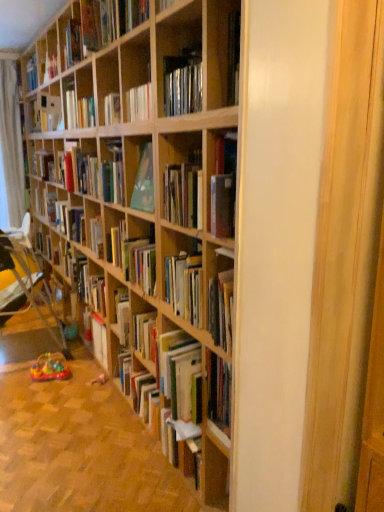
At what (x,y) coordinates should I click in order to perform the action: click on wooden bookcase at center. Please return your answer as a coordinate pair (x, y). This screenshot has height=512, width=384. Looking at the image, I should click on (151, 200).

This screenshot has width=384, height=512. In order to click on matte red book at center, which is counted as the 3th book, starting from the bottom in this screenshot , I will do `click(80, 172)`.

How much space does matte red book at center, which is counted as the 3th book, starting from the bottom, occupy horizontally?

matte red book at center, which is counted as the 3th book, starting from the bottom, is 6.97 inches in width.

Find the location of a particular element. Image resolution: width=384 pixels, height=512 pixels. wooden folding chair at lower left is located at coordinates (29, 275).

I want to click on hardcover book at center, which appears as the second book when ordered from the bottom, so click(134, 257).

Locate an element on the screen. Image resolution: width=384 pixels, height=512 pixels. hardcover book at upper left, marked as the first book in a top-to-bottom arrangement is located at coordinates (97, 24).

Does hardcover book at upper left, marked as the first book in a top-to-bottom arrangement, turn towards hardcover book at center, the third book when ordered from top to bottom?

No, hardcover book at upper left, marked as the first book in a top-to-bottom arrangement, is not oriented towards hardcover book at center, the third book when ordered from top to bottom.

Does hardcover book at upper left, marked as the first book in a top-to-bottom arrangement, have a smaller size compared to hardcover book at center, the third book when ordered from top to bottom?

Indeed, hardcover book at upper left, marked as the first book in a top-to-bottom arrangement, has a smaller size compared to hardcover book at center, the third book when ordered from top to bottom.

Based on the photo, considering the positions of objects hardcover book at upper left, marked as the first book in a top-to-bottom arrangement, and hardcover book at center, the third book when ordered from top to bottom, in the image provided, who is in front, hardcover book at upper left, marked as the first book in a top-to-bottom arrangement, or hardcover book at center, the third book when ordered from top to bottom,?

hardcover book at upper left, marked as the first book in a top-to-bottom arrangement.

Is hardcover book at upper left, the fourth book in the bottom-to-top sequence, completely or partially outside of hardcover book at center, the third book when ordered from top to bottom?

Yes.

From a real-world perspective, is white sheer curtain at left above or below wooden bookcase at center?

white sheer curtain at left is situated higher than wooden bookcase at center in the real world.

Considering the sizes of white sheer curtain at left and wooden bookcase at center in the image, is white sheer curtain at left taller or shorter than wooden bookcase at center?

Considering their sizes, white sheer curtain at left has more height than wooden bookcase at center.

Is white sheer curtain at left touching wooden bookcase at center?

No.

Considering the relative sizes of matte red book at center, which is counted as the 3th book, starting from the bottom, and wooden folding chair at lower left in the image provided, is matte red book at center, which is counted as the 3th book, starting from the bottom, wider than wooden folding chair at lower left?

No, matte red book at center, which is counted as the 3th book, starting from the bottom, is not wider than wooden folding chair at lower left.

Is matte red book at center, the second book from the top, taller or shorter than wooden folding chair at lower left?

Clearly, matte red book at center, the second book from the top, is shorter compared to wooden folding chair at lower left.

From the image's perspective, is matte red book at center, the second book from the top, beneath wooden folding chair at lower left?

No, from the image's perspective, matte red book at center, the second book from the top, is not beneath wooden folding chair at lower left.

This screenshot has height=512, width=384. In order to click on chair on the left of matte red book at center, the second book from the top in this screenshot , I will do `click(29, 275)`.

Does matte red book at center, which is counted as the 3th book, starting from the bottom, appear on the right side of plastic multicolored toy at lower left?

Yes, matte red book at center, which is counted as the 3th book, starting from the bottom, is to the right of plastic multicolored toy at lower left.

What's the angular difference between matte red book at center, the second book from the top, and plastic multicolored toy at lower left's facing directions?

The facing directions of matte red book at center, the second book from the top, and plastic multicolored toy at lower left are 0.0495 degrees apart.

From the image's perspective, is matte red book at center, the second book from the top, positioned above or below plastic multicolored toy at lower left?

Based on their image positions, matte red book at center, the second book from the top, is located above plastic multicolored toy at lower left.

From a real-world perspective, who is located lower, matte red book at center, which is counted as the 3th book, starting from the bottom, or plastic multicolored toy at lower left?

In real-world perspective, plastic multicolored toy at lower left is lower.

From the image's perspective, who appears lower, hardcover book at center, the third book when ordered from top to bottom, or hardcover book at upper left, marked as the first book in a top-to-bottom arrangement?

hardcover book at center, the third book when ordered from top to bottom, from the image's perspective.

Between hardcover book at center, the third book when ordered from top to bottom, and hardcover book at upper left, the fourth book in the bottom-to-top sequence, which one has smaller width?

hardcover book at center, the third book when ordered from top to bottom, is thinner.

What's the angular difference between hardcover book at center, the third book when ordered from top to bottom, and hardcover book at upper left, marked as the first book in a top-to-bottom arrangement,'s facing directions?

The angular difference between hardcover book at center, the third book when ordered from top to bottom, and hardcover book at upper left, marked as the first book in a top-to-bottom arrangement, is 0.00172 degrees.

From a real-world perspective, which object rests below the other?

hardcover book at center, which appears as the second book when ordered from the bottom, from a real-world perspective.

Which is closer, [60,102] or [126,280]?

Point [60,102] is positioned farther from the camera compared to point [126,280].

Between wooden bookcase at center and hardcover book at center, which appears as the second book when ordered from the bottom, which one is positioned in front?

wooden bookcase at center is in front.

Between wooden bookcase at center and hardcover book at center, the third book when ordered from top to bottom, which one has larger width?

hardcover book at center, the third book when ordered from top to bottom.

Is there a large distance between wooden bookcase at center and hardcover book at center, the third book when ordered from top to bottom?

No, wooden bookcase at center is in close proximity to hardcover book at center, the third book when ordered from top to bottom.

Between wooden folding chair at lower left and hardcover book at upper left, the fourth book in the bottom-to-top sequence, which one has larger width?

wooden folding chair at lower left.

Is wooden folding chair at lower left not near hardcover book at upper left, marked as the first book in a top-to-bottom arrangement?

Yes, wooden folding chair at lower left is far from hardcover book at upper left, marked as the first book in a top-to-bottom arrangement.

Consider the image. Considering the positions of objects wooden folding chair at lower left and hardcover book at upper left, marked as the first book in a top-to-bottom arrangement, in the image provided, who is more to the right, wooden folding chair at lower left or hardcover book at upper left, marked as the first book in a top-to-bottom arrangement,?

From the viewer's perspective, hardcover book at upper left, marked as the first book in a top-to-bottom arrangement, appears more on the right side.

From the image's perspective, is wooden folding chair at lower left beneath hardcover book at upper left, marked as the first book in a top-to-bottom arrangement?

Indeed, from the image's perspective, wooden folding chair at lower left is shown beneath hardcover book at upper left, marked as the first book in a top-to-bottom arrangement.

The height and width of the screenshot is (512, 384). I want to click on the 2nd book in front of the hardcover book at center, which appears as the second book when ordered from the bottom, starting your count from the anchor, so click(x=97, y=24).

In the image, there is a wooden bookcase at center. Identify the location of curtain above it (from the image's perspective). (11, 142).

Looking at the image, which one is located closer to wooden bookcase at center, hardcover book at center, the third book when ordered from top to bottom, or hardcover book at upper left, marked as the first book in a top-to-bottom arrangement?

hardcover book at center, the third book when ordered from top to bottom, lies closer to wooden bookcase at center than the other object.

Looking at the image, which one is located closer to plastic multicolored toy at lower left, white sheer curtain at left or wooden folding chair at lower left?

wooden folding chair at lower left.

Based on their spatial positions, is plastic multicolored toy at lower left or wooden folding chair at lower left further from white sheer curtain at left?

The object further to white sheer curtain at left is plastic multicolored toy at lower left.

From the image, which object appears to be farther from matte red book at center, the second book from the top, wooden bookcase at center or white sheer curtain at left?

white sheer curtain at left.

Estimate the real-world distances between objects in this image. Which object is further from matte red book at center, the second book from the top, hardcover book at center, the third book when ordered from top to bottom, or wooden bookcase at center?

wooden bookcase at center is further to matte red book at center, the second book from the top.

Based on their spatial positions, is wooden bookcase at center or hardcover book at center, the third book when ordered from top to bottom, closer to hardcover book at upper left, the fourth book in the bottom-to-top sequence?

wooden bookcase at center.

Which object lies further to the anchor point hardcover book at center, the third book when ordered from top to bottom, hardcover book at center, the fourth book in the top-to-bottom sequence, or hardcover book at upper left, marked as the first book in a top-to-bottom arrangement?

hardcover book at upper left, marked as the first book in a top-to-bottom arrangement.

Which object lies further to the anchor point hardcover book at upper left, marked as the first book in a top-to-bottom arrangement, hardcover book at center, the 1th book in the bottom-to-top sequence, or wooden bookcase at center?

The object further to hardcover book at upper left, marked as the first book in a top-to-bottom arrangement, is hardcover book at center, the 1th book in the bottom-to-top sequence.

In order to click on chair between white sheer curtain at left and plastic multicolored toy at lower left vertically in this screenshot , I will do `click(29, 275)`.

Find the location of a particular element. book between matte red book at center, which is counted as the 3th book, starting from the bottom, and wooden folding chair at lower left from top to bottom is located at coordinates (134, 257).

The image size is (384, 512). I want to click on toy between wooden folding chair at lower left and hardcover book at center, the fourth book in the top-to-bottom sequence, so click(x=50, y=368).

In order to click on toy between hardcover book at center, the third book when ordered from top to bottom, and white sheer curtain at left, along the z-axis in this screenshot , I will do `click(50, 368)`.